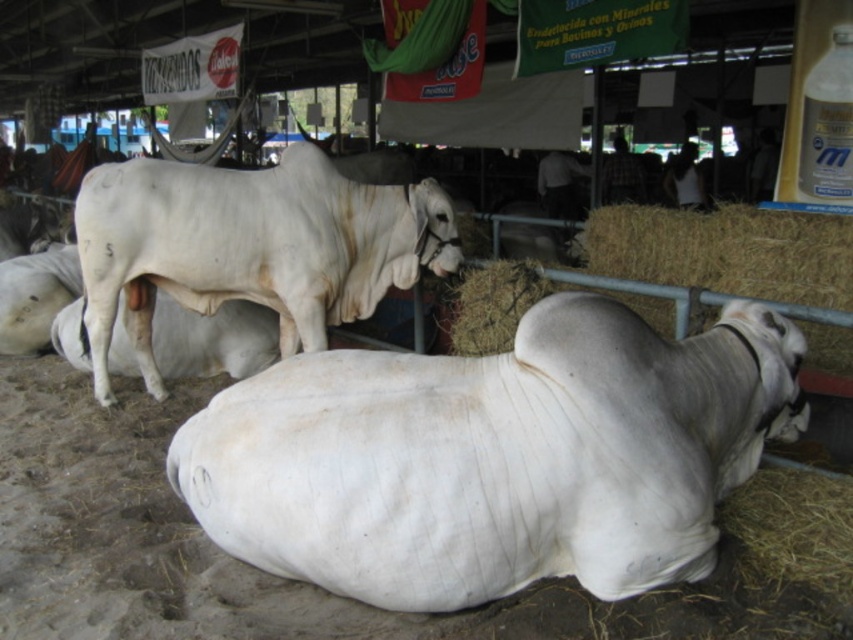
You are a farmer standing at the entrance of the livestock market. You see the white smooth cow at lower center. Can you safely approach it without entering its personal space? Assume the cow requires at least 5 feet of space to feel comfortable.

The white smooth cow at lower center and viewer are 8.01 feet apart, so yes, you can approach it safely as the distance is more than the required 5 feet of personal space.

You are a photographer positioned at the camera location. You want to take a closeup shot of the cow with the ear tag marked 75. The cow is at point (x=132, y=237). However, there is another cow lying down at point (x=651, y=356). Will the lying cow block your view of the tagged cow?

Point (x=651, y=356) is closer to the camera than point (x=132, y=237). Therefore, the lying cow at point (x=651, y=356) will block your view of the tagged cow at point (x=132, y=237).